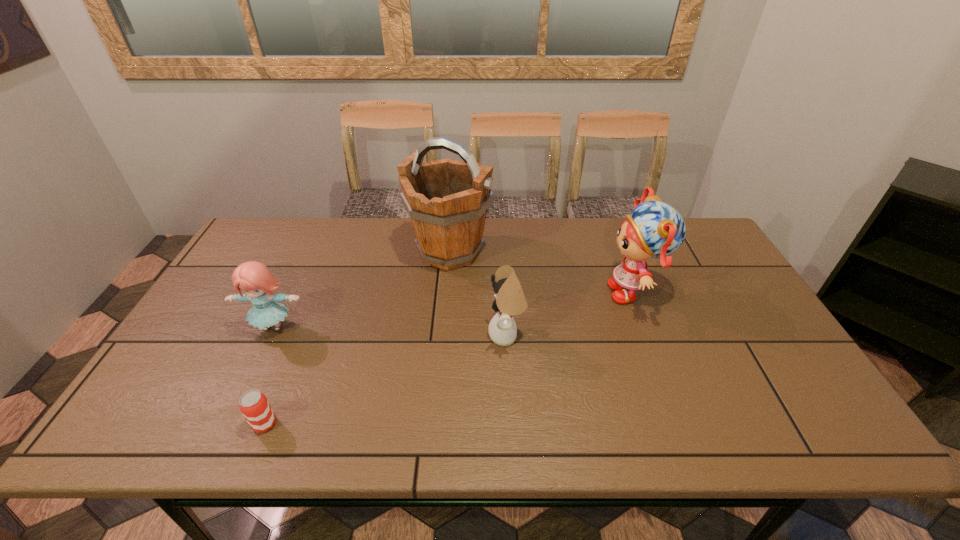
Find the location of a particular element. the tallest object is located at coordinates (x=447, y=200).

Where is `the rightmost doll`? This screenshot has height=540, width=960. the rightmost doll is located at coordinates (654, 229).

Image resolution: width=960 pixels, height=540 pixels. Find the location of `the fourth shortest object`. the fourth shortest object is located at coordinates (654, 229).

Where is `the second doll from right to left`? The height and width of the screenshot is (540, 960). the second doll from right to left is located at coordinates (510, 300).

The height and width of the screenshot is (540, 960). I want to click on the leftmost doll, so click(x=256, y=281).

What are the coordinates of `the nearest object` in the screenshot? It's located at (253, 404).

The height and width of the screenshot is (540, 960). I want to click on the shortest object, so click(x=253, y=404).

The width and height of the screenshot is (960, 540). Find the location of `vacant region located 0.200m on the front of the bucket`. vacant region located 0.200m on the front of the bucket is located at coordinates (444, 328).

I want to click on free location located on the face of the fourth shortest object, so click(540, 292).

Locate an element on the screen. This screenshot has width=960, height=540. vacant area located on the face of the fourth shortest object is located at coordinates (486, 292).